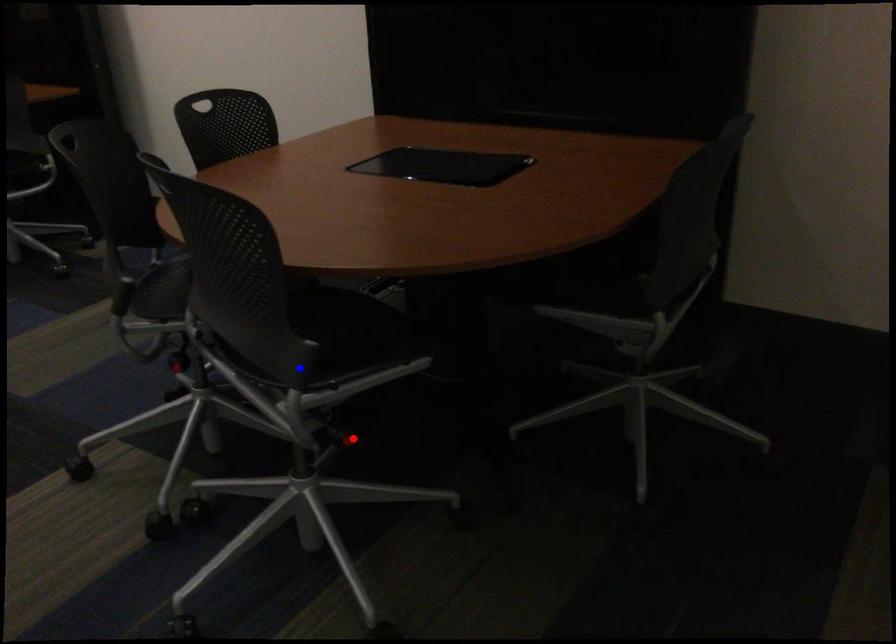
Question: In the image, two points are highlighted. Which point is nearer to the camera? Reply with the corresponding letter.

Choices:
 (A) blue point
 (B) red point

Answer: (A)